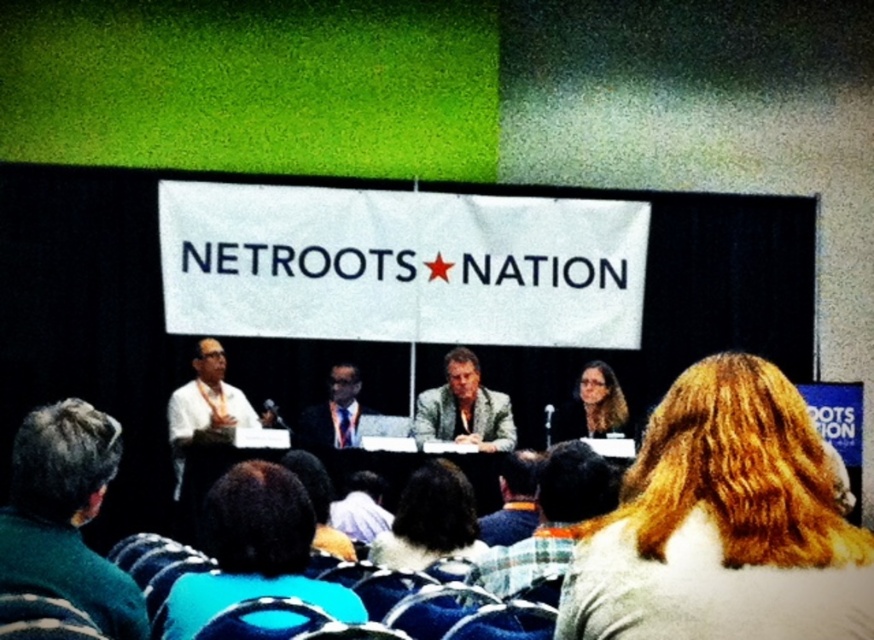
Question: Is dark green sweater at lower left behind light brown leather jacket at center?

Choices:
 (A) no
 (B) yes

Answer: (A)

Question: Which object is the farthest from the dark blue suit at center?

Choices:
 (A) blonde hair at center
 (B) light brown leather jacket at center
 (C) plaid shirt at center
 (D) dark brown hair at center

Answer: (A)

Question: Based on their relative distances, which object is farther from the dark brown hair at center?

Choices:
 (A) blonde hair at center
 (B) blue fabric at lower center
 (C) plaid shirt at center
 (D) light brown leather jacket at center

Answer: (D)

Question: Can you confirm if matte black glasses at center is wider than dark blue suit at center?

Choices:
 (A) no
 (B) yes

Answer: (B)

Question: Which object is the closest to the dark blue suit at center?

Choices:
 (A) blue fabric at lower center
 (B) matte black glasses at center

Answer: (B)

Question: Considering the relative positions of blue fabric at lower center and plaid shirt at center in the image provided, where is blue fabric at lower center located with respect to plaid shirt at center?

Choices:
 (A) below
 (B) above

Answer: (A)